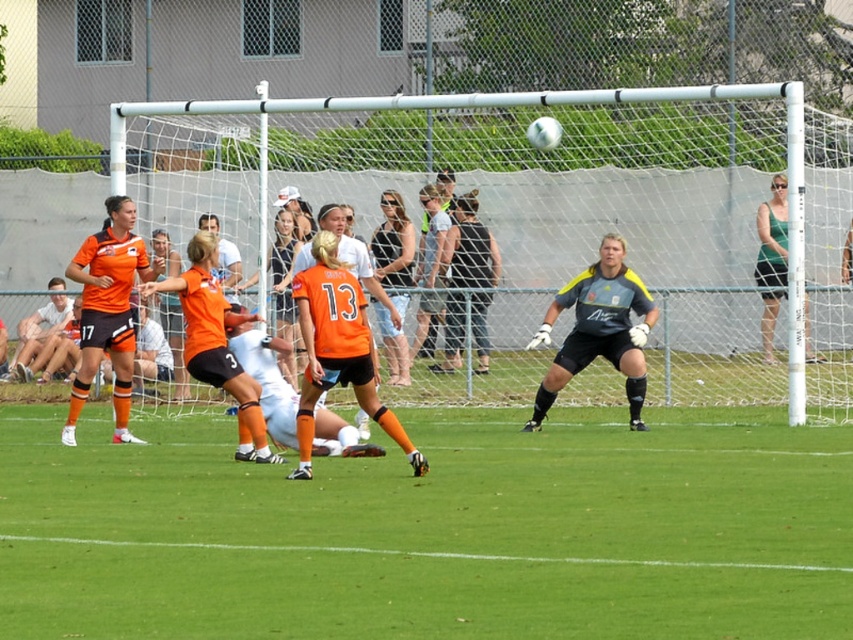
You are a soccer referee positioned at the edge of the field. You need to determine if the ball, which is currently on the green grass at center, is within the playing area. Based on the orange matte jersey at left, can you confirm if the ball is still on the field?

The green grass at center is in front of the orange matte jersey at left, which means the ball is still on the field since it is positioned in front of the player.

You are standing at the point marked by coordinates point (x=802, y=404). You want to walk to the soccer field entrance located 20 meters away from you. Is the entrance closer to you or to the soccer field goal post? Please explain your reasoning.

The entrance is closer to you because you are only 15.10 meters away from the point (x=802, y=404), so the entrance is 20 meters from you, which is farther than the 15.10 meters between you and the point. Wait, the question states the entrance is 20 meters away from you, so the entrance is 20 meters away from your current position at point (x=802, y=404). The goal post is part of the soccer field, but the distance from the point to the goal post isn not provided. The question might be missing information. Since

You are a soccer player preparing to take a penalty kick. You notice the green grass at center and the green fabric tank top at upper right in your line of sight. Which object is bigger in your view?

The green grass at center is larger in size than the green fabric tank top at upper right, so the green grass at center appears bigger in your view.